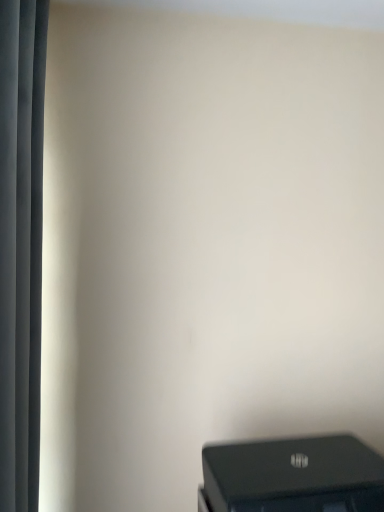
The width and height of the screenshot is (384, 512). What do you see at coordinates (292, 476) in the screenshot?
I see `black plastic printer at lower right` at bounding box center [292, 476].

Measure the distance between point [264,444] and camera.

Point [264,444] is 1.11 meters from camera.

You are a GUI agent. You are given a task and a screenshot of the screen. Output one action in this format:
    pyautogui.click(x=<x>, y=<y>)
    Task: Click on the black plastic printer at lower right
    The width and height of the screenshot is (384, 512).
    Given the screenshot: What is the action you would take?
    pyautogui.click(x=292, y=476)

Where is `black plastic printer at lower right`? black plastic printer at lower right is located at coordinates (292, 476).